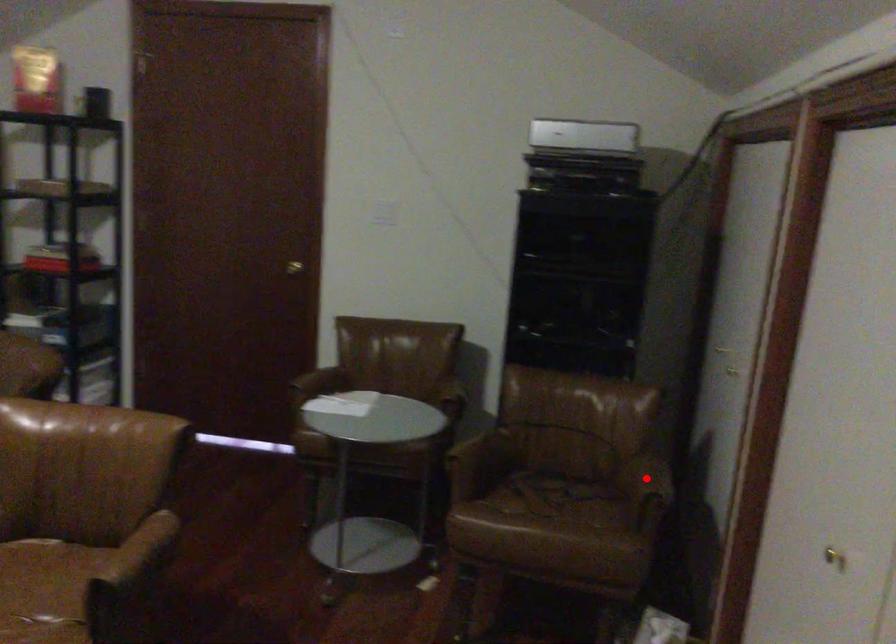
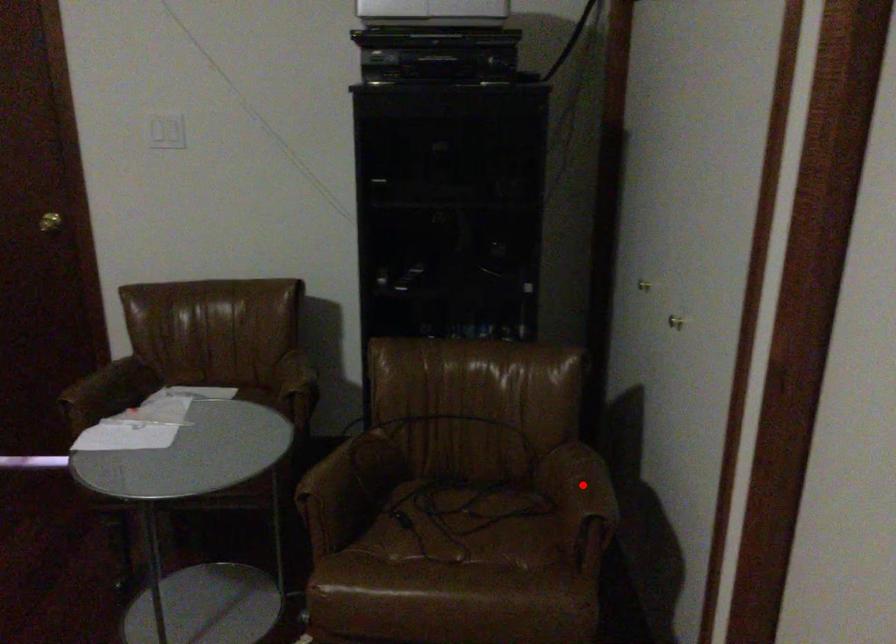
I am providing you with two images of the same scene from different viewpoints. A red point is marked on the first image and another point is marked on the second image. Does the point marked in image1 correspond to the same location as the one in image2?

Yes